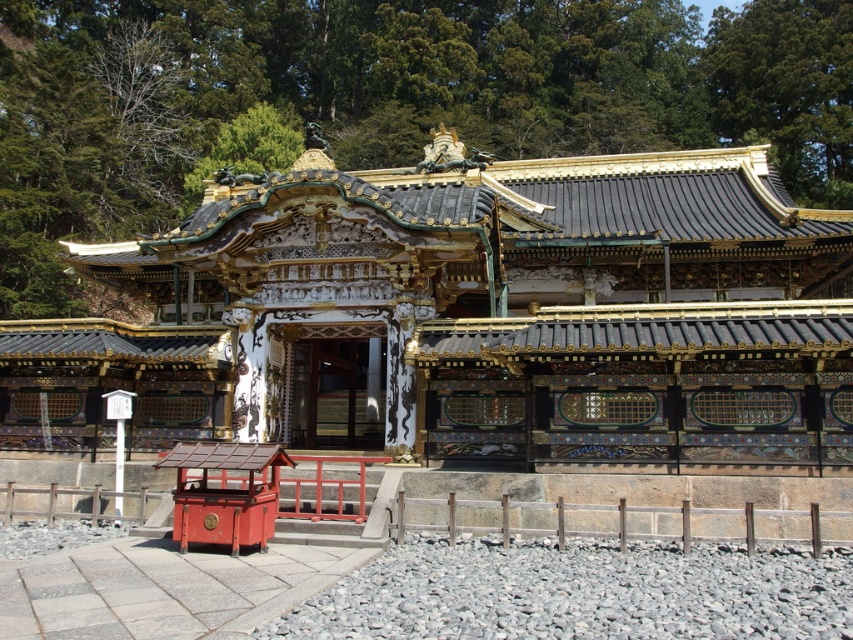
Question: Which point is closer to the camera?

Choices:
 (A) (439, 298)
 (B) (258, 470)

Answer: (B)

Question: Which of the following is the closest to the observer?

Choices:
 (A) smooth red wooden box at lower left
 (B) polished wood shrine at center

Answer: (A)

Question: Does polished wood shrine at center have a larger size compared to smooth red wooden box at lower left?

Choices:
 (A) yes
 (B) no

Answer: (A)

Question: Considering the relative positions of polished wood shrine at center and smooth red wooden box at lower left in the image provided, where is polished wood shrine at center located with respect to smooth red wooden box at lower left?

Choices:
 (A) below
 (B) above

Answer: (B)

Question: Does polished wood shrine at center lie in front of smooth red wooden box at lower left?

Choices:
 (A) no
 (B) yes

Answer: (A)